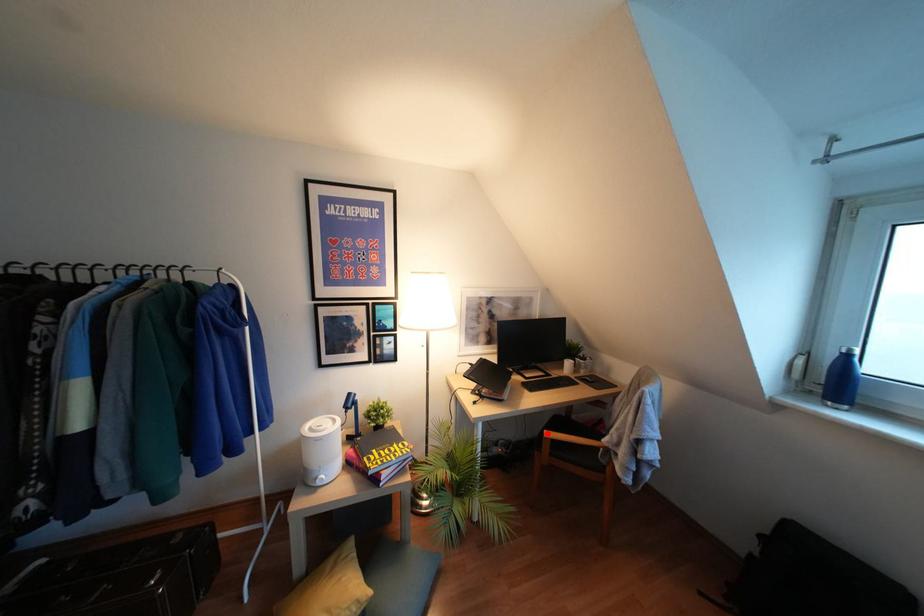
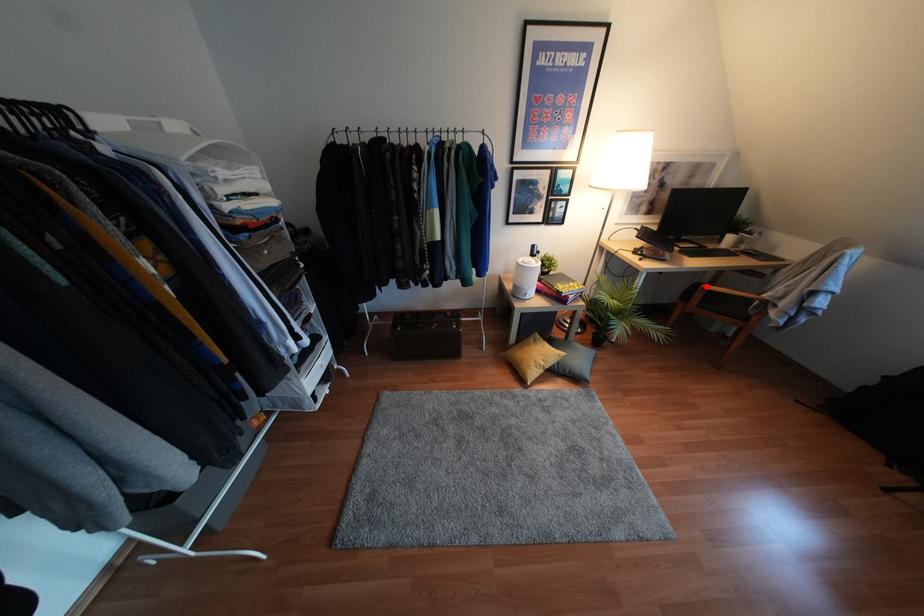
I am providing you with two images of the same scene from different viewpoints. A red point is marked on the first image and another point is marked on the second image. Is the red point in image1 aligned with the point shown in image2?

Yes